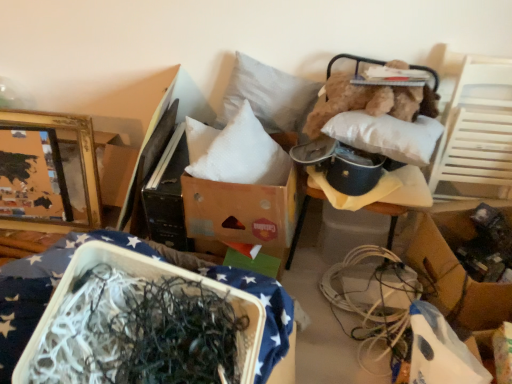
Question: Is white plastic wire at lower right looking in the opposite direction of brown cardboard box at lower right, acting as the 2th cardboard box starting from the left?

Choices:
 (A) yes
 (B) no

Answer: (B)

Question: Is white plastic wire at lower right shorter than brown cardboard box at lower right, positioned as the 1th cardboard box in right-to-left order?

Choices:
 (A) no
 (B) yes

Answer: (A)

Question: Considering the relative positions of white plastic wire at lower right and brown cardboard box at lower right, acting as the 2th cardboard box starting from the left, in the image provided, is white plastic wire at lower right to the left of brown cardboard box at lower right, acting as the 2th cardboard box starting from the left, from the viewer's perspective?

Choices:
 (A) yes
 (B) no

Answer: (A)

Question: Would you say brown cardboard box at lower right, acting as the 2th cardboard box starting from the left, is part of white plastic wire at lower right's contents?

Choices:
 (A) no
 (B) yes

Answer: (A)

Question: Is white plastic wire at lower right closer to camera compared to brown cardboard box at lower right, positioned as the 1th cardboard box in right-to-left order?

Choices:
 (A) no
 (B) yes

Answer: (B)

Question: In terms of height, does white styrofoam container at lower left, which is the 2th furniture from right to left, look taller or shorter compared to white plastic wire at lower right?

Choices:
 (A) tall
 (B) short

Answer: (B)

Question: Is white styrofoam container at lower left, positioned as the 1th furniture in front-to-back order, bigger or smaller than white plastic wire at lower right?

Choices:
 (A) big
 (B) small

Answer: (B)

Question: From a real-world perspective, relative to white plastic wire at lower right, is white styrofoam container at lower left, positioned as the 1th furniture in front-to-back order, vertically above or below?

Choices:
 (A) below
 (B) above

Answer: (B)

Question: Is white styrofoam container at lower left, marked as the 1th furniture in a left-to-right arrangement, spatially inside white plastic wire at lower right, or outside of it?

Choices:
 (A) outside
 (B) inside

Answer: (A)

Question: Is fuzzy brown teddy bear at upper right in front of or behind white soft pillow at center, which appears as the second pillow when viewed from the right, in the image?

Choices:
 (A) front
 (B) behind

Answer: (A)

Question: From the image's perspective, relative to white soft pillow at center, which appears as the second pillow when viewed from the right, is fuzzy brown teddy bear at upper right above or below?

Choices:
 (A) above
 (B) below

Answer: (A)

Question: In terms of height, does fuzzy brown teddy bear at upper right look taller or shorter compared to white soft pillow at center, acting as the first pillow starting from the left?

Choices:
 (A) tall
 (B) short

Answer: (B)

Question: Choose the correct answer: Is fuzzy brown teddy bear at upper right inside white soft pillow at center, which appears as the second pillow when viewed from the right, or outside it?

Choices:
 (A) outside
 (B) inside

Answer: (A)

Question: Based on their positions, is white fabric cushion at upper right, placed as the second furniture when sorted from front to back, located to the left or right of gold/gilded picture frame at upper left?

Choices:
 (A) right
 (B) left

Answer: (A)

Question: From a real-world perspective, is white fabric cushion at upper right, acting as the 1th furniture starting from the back, positioned above or below gold/gilded picture frame at upper left?

Choices:
 (A) above
 (B) below

Answer: (A)